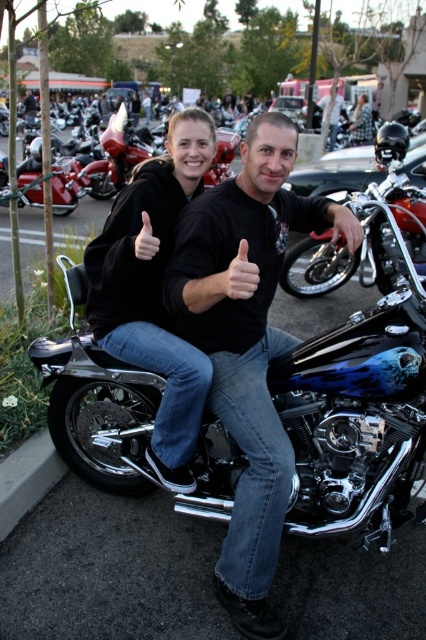
Which of these two, black matte jacket at center or gray concrete curb at lower left, stands shorter?

Standing shorter between the two is gray concrete curb at lower left.

The image size is (426, 640). Describe the element at coordinates (154, 289) in the screenshot. I see `black matte jacket at center` at that location.

You are a GUI agent. You are given a task and a screenshot of the screen. Output one action in this format:
    pyautogui.click(x=<x>, y=<y>)
    Task: Click on the black matte jacket at center
    
    Given the screenshot: What is the action you would take?
    pyautogui.click(x=154, y=289)

Locate an element on the screen. black matte jacket at center is located at coordinates (154, 289).

Can you confirm if gray concrete curb at lower left is bigger than denim jacket at center?

Actually, gray concrete curb at lower left might be smaller than denim jacket at center.

Between gray concrete curb at lower left and denim jacket at center, which one appears on the right side from the viewer's perspective?

denim jacket at center is more to the right.

Is point (28, 484) farther from viewer compared to point (371, 108)?

No.

The width and height of the screenshot is (426, 640). Identify the location of gray concrete curb at lower left. (26, 477).

Can you confirm if black matte shirt at center is thinner than black matte motorcycle at center?

No, black matte shirt at center is not thinner than black matte motorcycle at center.

Who is higher up, black matte shirt at center or black matte motorcycle at center?

black matte motorcycle at center is above.

Is point (273, 216) positioned before point (321, 99)?

Yes.

The width and height of the screenshot is (426, 640). I want to click on black matte shirt at center, so click(247, 342).